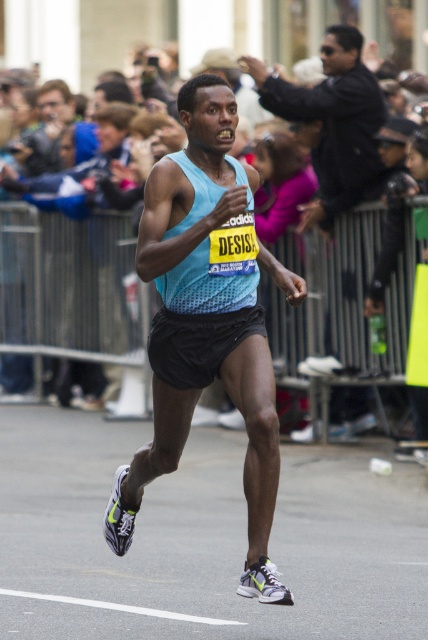
Question: Which point is farther to the camera?

Choices:
 (A) light blue fabric tank top at center
 (B) matte blue tank top at center
 (C) dark gray metal fence at center

Answer: (C)

Question: Does light blue fabric tank top at center have a lesser width compared to matte blue tank top at center?

Choices:
 (A) no
 (B) yes

Answer: (B)

Question: Which point is closer to the camera?

Choices:
 (A) (187, 291)
 (B) (374, 148)
 (C) (219, 70)

Answer: (A)

Question: Which of the following is the closest to the observer?

Choices:
 (A) (341, 26)
 (B) (79, 266)
 (C) (196, 148)

Answer: (C)

Question: Does matte blue tank top at center have a larger size compared to dark gray metal fence at center?

Choices:
 (A) yes
 (B) no

Answer: (A)

Question: Is light blue fabric tank top at center below matte blue tank top at center?

Choices:
 (A) no
 (B) yes

Answer: (B)